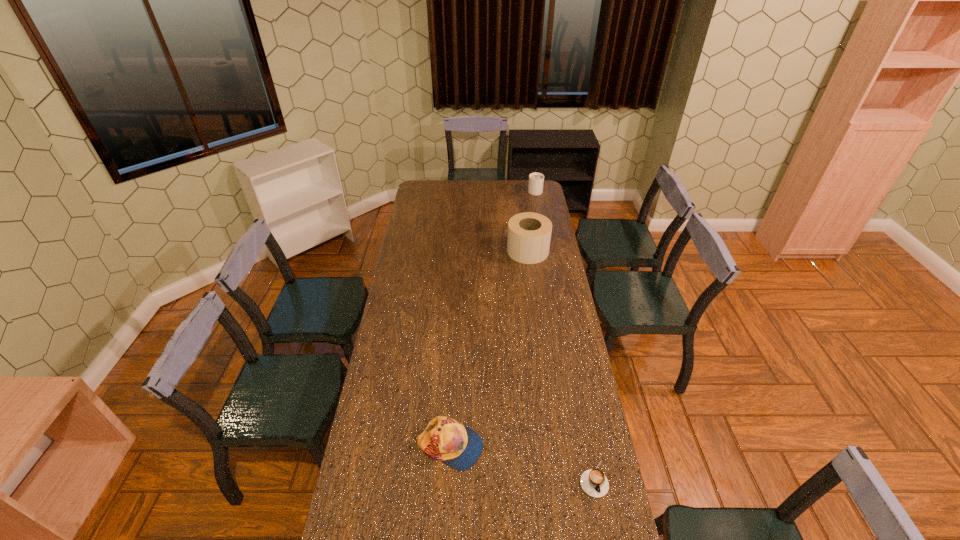
This screenshot has height=540, width=960. I want to click on the second farthest object, so click(529, 234).

At what (x,y) coordinates should I click in order to perform the action: click on toilet tissue. Please return your answer as a coordinate pair (x, y). The height and width of the screenshot is (540, 960). Looking at the image, I should click on (529, 234).

Find the location of `the farthest object`. the farthest object is located at coordinates (536, 180).

I want to click on the farther cappuccino, so click(x=536, y=180).

This screenshot has width=960, height=540. What are the coordinates of `the leftmost object` in the screenshot? It's located at (445, 439).

This screenshot has width=960, height=540. I want to click on cap, so click(x=445, y=439).

Where is `the nearer cappuccino`? This screenshot has height=540, width=960. the nearer cappuccino is located at coordinates (593, 481).

Identify the location of the shortest object. (593, 481).

Identify the location of vacant space located 0.130m on the left of the tallest object. (483, 251).

Identify the location of vacant space situated on the side with the handle of the taller cappuccino. This screenshot has height=540, width=960. pos(533,180).